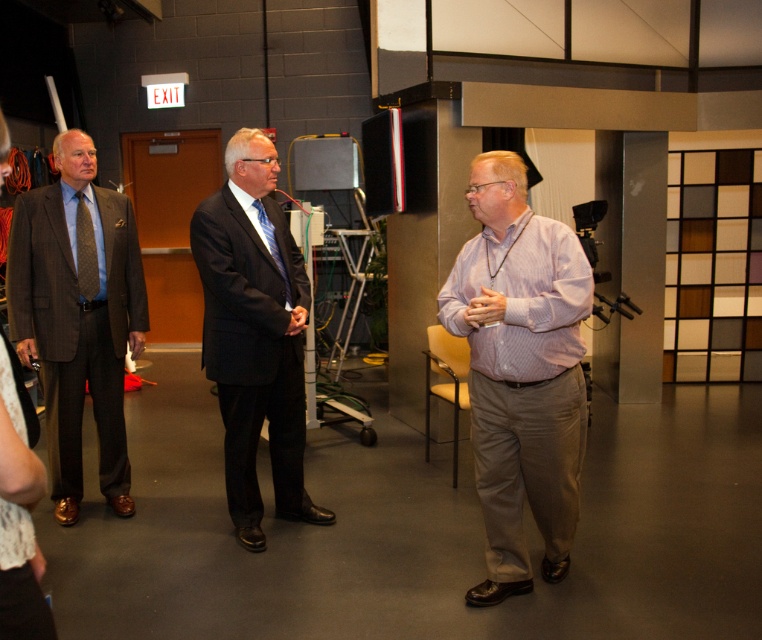
Which is behind, point (279, 224) or point (94, 241)?

The point (94, 241) is more distant.

This screenshot has height=640, width=762. Identify the location of matte black suit at center. (255, 333).

I want to click on matte brown suit at left, so click(x=78, y=316).

Does point (40, 358) come in front of point (264, 218)?

No, it is not.

Locate an element on the screen. matte brown suit at left is located at coordinates (78, 316).

Does matte brown suit at left have a lesser height compared to matte black suit at center?

No, matte brown suit at left is not shorter than matte black suit at center.

Between matte brown suit at left and matte black suit at center, which one is positioned lower?

Positioned lower is matte black suit at center.

Is point (117, 448) positioned in front of point (287, 422)?

No, it is not.

Find the location of a particular element. The height and width of the screenshot is (640, 762). matte brown suit at left is located at coordinates (78, 316).